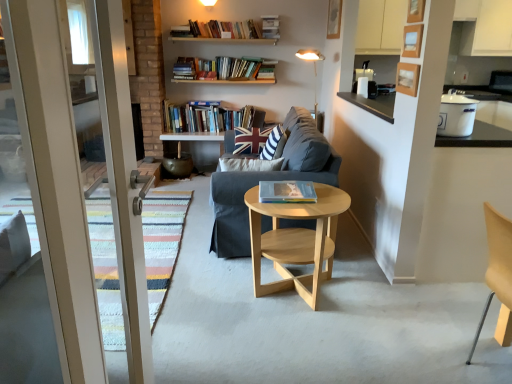
Question: In terms of height, does striped fabric pillow at center, marked as the 1th pillow in a front-to-back arrangement, look taller or shorter compared to white enamel pot at upper right?

Choices:
 (A) tall
 (B) short

Answer: (A)

Question: Do you think striped fabric pillow at center, which is the second pillow in back-to-front order, is within white enamel pot at upper right, or outside of it?

Choices:
 (A) outside
 (B) inside

Answer: (A)

Question: Based on their relative distances, which object is nearer to the striped fabric pillow at center, marked as the 1th pillow in a front-to-back arrangement?

Choices:
 (A) hardcover books at upper center, acting as the 1th book starting from the top
 (B) hardcover book at center, which appears as the first book when viewed from the front
 (C) union jack fabric pillow at center, the second pillow in the front-to-back sequence
 (D) white fabric lampshade at upper center
 (E) light wood/woodenobject at center

Answer: (C)

Question: Based on their relative distances, which object is nearer to the union jack fabric pillow at center, the second pillow in the front-to-back sequence?

Choices:
 (A) hardcover books at upper center, positioned as the second book in right-to-left order
 (B) dark gray fabric couch at center
 (C) light wood/woodenobject at center
 (D) white enamel pot at upper right
 (E) hardcover book at center, placed as the 2th book when sorted from top to bottom

Answer: (B)